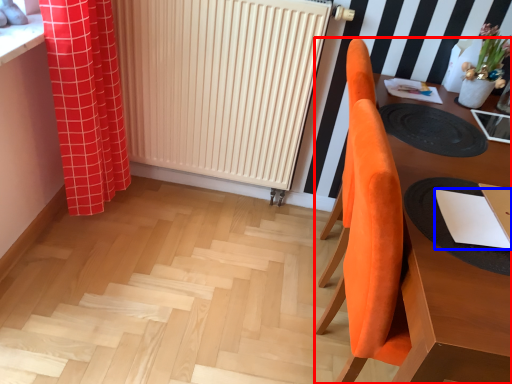
Question: Which object appears farthest to the camera in this image, furniture (highlighted by a red box) or notepad (highlighted by a blue box)?

Choices:
 (A) furniture
 (B) notepad

Answer: (B)